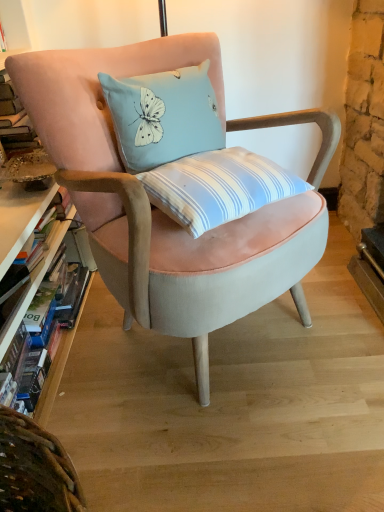
This screenshot has height=512, width=384. Identify the location of hardcover book at left. (58, 362).

Describe the element at coordinates (58, 362) in the screenshot. I see `hardcover book at left` at that location.

Locate an element on the screen. This screenshot has height=512, width=384. velvet pink chair at center is located at coordinates (159, 210).

Measure the distance between velvet pink chair at center and camera.

The distance of velvet pink chair at center from camera is 30.86 inches.

Describe the element at coordinates (159, 210) in the screenshot. I see `velvet pink chair at center` at that location.

The image size is (384, 512). In order to click on hardcover book at left in this screenshot , I will do `click(58, 362)`.

Is hardcover book at left to the right of velvet pink chair at center from the viewer's perspective?

Incorrect, hardcover book at left is not on the right side of velvet pink chair at center.

Does hardcover book at left lie behind velvet pink chair at center?

Yes, the depth of hardcover book at left is greater than that of velvet pink chair at center.

Is point (67, 339) closer or farther from the camera than point (324, 131)?

Point (67, 339) is farther from the camera than point (324, 131).

From the image's perspective, between hardcover book at left and velvet pink chair at center, which one is located above?

velvet pink chair at center is shown above in the image.

From a real-world perspective, which is physically above, hardcover book at left or velvet pink chair at center?

velvet pink chair at center, from a real-world perspective.

Considering the sizes of hardcover book at left and velvet pink chair at center in the image, is hardcover book at left wider or thinner than velvet pink chair at center?

In the image, hardcover book at left appears to be more narrow than velvet pink chair at center.

In terms of height, does hardcover book at left look taller or shorter compared to velvet pink chair at center?

In the image, hardcover book at left appears to be shorter than velvet pink chair at center.

Does hardcover book at left have a smaller size compared to velvet pink chair at center?

Indeed, hardcover book at left has a smaller size compared to velvet pink chair at center.

Is hardcover book at left spatially inside velvet pink chair at center, or outside of it?

The correct answer is: outside.

Is hardcover book at left positioned far away from velvet pink chair at center?

No.

Is hardcover book at left looking in the opposite direction of velvet pink chair at center?

No.

In the scene shown: How different are the orientations of hardcover book at left and velvet pink chair at center in degrees?

The angular difference between hardcover book at left and velvet pink chair at center is 50.6 degrees.

I want to click on chair in front of the hardcover book at left, so click(159, 210).

Visually, is velvet pink chair at center positioned to the left or to the right of hardcover book at left?

velvet pink chair at center is positioned on hardcover book at left's right side.

Based on the photo, is velvet pink chair at center further to the viewer compared to hardcover book at left?

No, it is not.

Does point (327, 121) come in front of point (62, 348)?

Yes, point (327, 121) is in front of point (62, 348).

From the image's perspective, which is below, velvet pink chair at center or hardcover book at left?

From the image's view, hardcover book at left is below.

From a real-world perspective, relative to hardcover book at left, is velvet pink chair at center vertically above or below?

From a real-world perspective, velvet pink chair at center is physically above hardcover book at left.

Which object is thinner, velvet pink chair at center or hardcover book at left?

With smaller width is hardcover book at left.

In terms of height, does velvet pink chair at center look taller or shorter compared to hardcover book at left?

Considering their sizes, velvet pink chair at center has more height than hardcover book at left.

Between velvet pink chair at center and hardcover book at left, which one has larger size?

With larger size is velvet pink chair at center.

Based on the photo, which is correct: velvet pink chair at center is inside hardcover book at left, or outside of it?

velvet pink chair at center is outside hardcover book at left.

Based on the photo, are velvet pink chair at center and hardcover book at left far apart?

No, velvet pink chair at center is not far away from hardcover book at left.

Is velvet pink chair at center turned away from hardcover book at left?

No, velvet pink chair at center is not facing away from hardcover book at left.

What's the angular difference between velvet pink chair at center and hardcover book at left's facing directions?

There is a 50.6-degree angle between the facing directions of velvet pink chair at center and hardcover book at left.

How distant is velvet pink chair at center from hardcover book at left?

They are 23.98 inches apart.

The height and width of the screenshot is (512, 384). I want to click on chair that appears above the hardcover book at left (from a real-world perspective), so click(159, 210).

Locate an element on the screen. The width and height of the screenshot is (384, 512). chair above the hardcover book at left (from a real-world perspective) is located at coordinates (159, 210).

You are a GUI agent. You are given a task and a screenshot of the screen. Output one action in this format:
    pyautogui.click(x=<x>, y=<y>)
    Task: Click on the chair above the hardcover book at left (from the image's perspective)
    
    Given the screenshot: What is the action you would take?
    pyautogui.click(x=159, y=210)